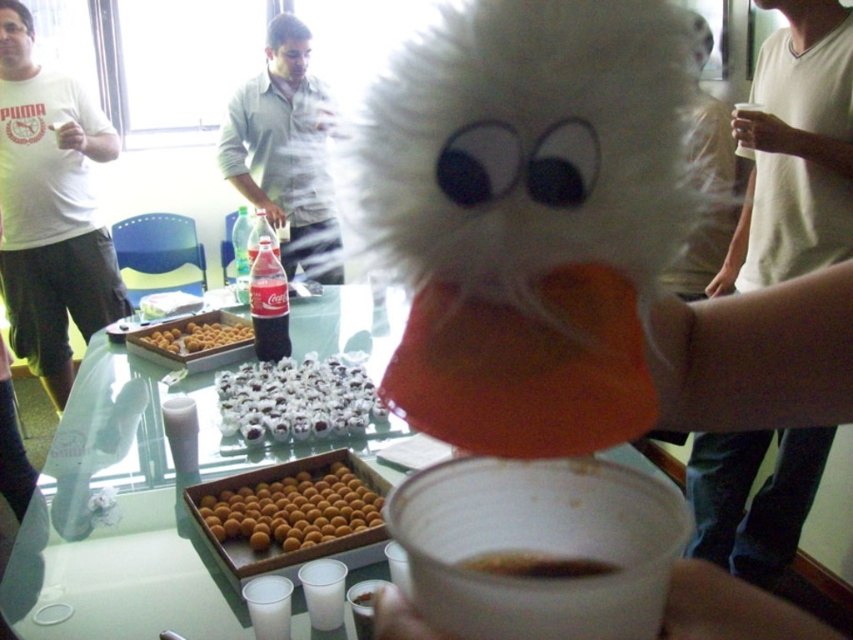
Is white cotton shirt at center bigger than orange matte/soft food at lower left?

Correct, white cotton shirt at center is larger in size than orange matte/soft food at lower left.

Is white cotton shirt at center thinner than orange matte/soft food at lower left?

Incorrect, white cotton shirt at center's width is not less than orange matte/soft food at lower left's.

This screenshot has height=640, width=853. Find the location of `white cotton shirt at center`. white cotton shirt at center is located at coordinates (281, 150).

The width and height of the screenshot is (853, 640). What do you see at coordinates (293, 508) in the screenshot?
I see `orange matte/soft food at lower left` at bounding box center [293, 508].

From the picture: Is orange matte/soft food at lower left below white sugary candy at center?

Indeed, orange matte/soft food at lower left is positioned under white sugary candy at center.

The width and height of the screenshot is (853, 640). Identify the location of orange matte/soft food at lower left. (293, 508).

Between point (99, 289) and point (305, 536), which one is positioned in front?

Point (305, 536)

Consider the image. Can you confirm if white cotton shirt at upper left is bigger than orange matte/soft food at lower left?

Correct, white cotton shirt at upper left is larger in size than orange matte/soft food at lower left.

The image size is (853, 640). Find the location of `white cotton shirt at upper left`. white cotton shirt at upper left is located at coordinates (51, 208).